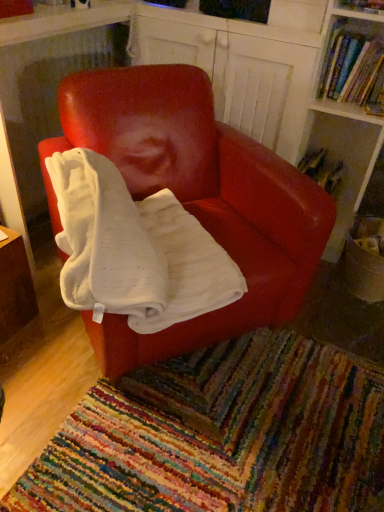
What do you see at coordinates (195, 198) in the screenshot?
I see `matte red chair at center` at bounding box center [195, 198].

Identify the location of matte red chair at center. The height and width of the screenshot is (512, 384). (195, 198).

How much space does hardcover book at upper right, acting as the second book starting from the back, occupy vertically?

hardcover book at upper right, acting as the second book starting from the back, is 11.87 inches tall.

Identify the location of matte red chair at center. This screenshot has height=512, width=384. (195, 198).

Is multicolored woven mat at lower center surrounding matte red chair at center?

Actually, matte red chair at center is outside multicolored woven mat at lower center.

Consider the image. Considering the relative sizes of multicolored woven mat at lower center and matte red chair at center in the image provided, is multicolored woven mat at lower center wider than matte red chair at center?

Yes, multicolored woven mat at lower center is wider than matte red chair at center.

Considering the positions of objects multicolored woven mat at lower center and matte red chair at center in the image provided, who is more to the right, multicolored woven mat at lower center or matte red chair at center?

multicolored woven mat at lower center is more to the right.

Are multicolored woven mat at lower center and matte red chair at center making contact?

No, multicolored woven mat at lower center is not in contact with matte red chair at center.

Which of these two, matte red chair at center or hardcover book at upper right, which is counted as the second book, starting from the bottom, stands shorter?

With less height is hardcover book at upper right, which is counted as the second book, starting from the bottom.

Is matte red chair at center turned away from hardcover book at upper right, the first book from the front?

No, matte red chair at center's orientation is not away from hardcover book at upper right, the first book from the front.

How distant is matte red chair at center from hardcover book at upper right, the first book from the front?

matte red chair at center and hardcover book at upper right, the first book from the front, are 30.21 inches apart.

Does matte red chair at center appear on the left side of hardcover book at upper right, which is counted as the second book, starting from the bottom?

Correct, you'll find matte red chair at center to the left of hardcover book at upper right, which is counted as the second book, starting from the bottom.

Which is correct: hardcover book at upper right, which is the 2th book from top to bottom, is inside multicolored woven mat at lower center, or outside of it?

The correct answer is: outside.

Is hardcover book at upper right, the 1th book in the back-to-front sequence, placed right next to multicolored woven mat at lower center?

No, hardcover book at upper right, the 1th book in the back-to-front sequence, is not beside multicolored woven mat at lower center.

From the image's perspective, is hardcover book at upper right, which is the 2th book from top to bottom, located beneath multicolored woven mat at lower center?

No.

This screenshot has height=512, width=384. I want to click on the 1st book above when counting from the multicolored woven mat at lower center (from the image's perspective), so click(x=321, y=170).

Which object is closer to the camera, multicolored woven mat at lower center or hardcover book at upper right, acting as the second book starting from the back?

Positioned in front is multicolored woven mat at lower center.

Where is `the 1st book behind the multicolored woven mat at lower center, starting your count from the anchor`? The width and height of the screenshot is (384, 512). the 1st book behind the multicolored woven mat at lower center, starting your count from the anchor is located at coordinates (352, 67).

Considering the relative sizes of multicolored woven mat at lower center and hardcover book at upper right, acting as the 1th book starting from the top, in the image provided, is multicolored woven mat at lower center smaller than hardcover book at upper right, acting as the 1th book starting from the top,?

Incorrect, multicolored woven mat at lower center is not smaller in size than hardcover book at upper right, acting as the 1th book starting from the top.

From a real-world perspective, is multicolored woven mat at lower center positioned above or below hardcover book at upper right, acting as the 1th book starting from the top?

From a real-world perspective, multicolored woven mat at lower center is physically below hardcover book at upper right, acting as the 1th book starting from the top.

Is hardcover book at upper right, which is counted as the second book, starting from the bottom, located outside matte red chair at center?

Indeed, hardcover book at upper right, which is counted as the second book, starting from the bottom, is completely outside matte red chair at center.

From the picture: Can you confirm if hardcover book at upper right, which is counted as the second book, starting from the bottom, is wider than matte red chair at center?

In fact, hardcover book at upper right, which is counted as the second book, starting from the bottom, might be narrower than matte red chair at center.

What's the angular difference between hardcover book at upper right, the first book from the front, and matte red chair at center's facing directions?

The facing directions of hardcover book at upper right, the first book from the front, and matte red chair at center are 50 degrees apart.

Which of these two, hardcover book at upper right, acting as the second book starting from the back, or matte red chair at center, stands shorter?

Standing shorter between the two is hardcover book at upper right, acting as the second book starting from the back.

Who is taller, hardcover book at upper right, acting as the second book starting from the back, or hardcover book at upper right, which is the 2th book from top to bottom?

hardcover book at upper right, acting as the second book starting from the back, is taller.

In the scene shown: Which is more to the left, hardcover book at upper right, acting as the 1th book starting from the top, or hardcover book at upper right, which is counted as the 2th book, starting from the front?

Positioned to the left is hardcover book at upper right, which is counted as the 2th book, starting from the front.

Is hardcover book at upper right, the first book from the front, positioned far away from hardcover book at upper right, which is counted as the 2th book, starting from the front?

hardcover book at upper right, the first book from the front, is near hardcover book at upper right, which is counted as the 2th book, starting from the front, not far away.

Which is behind, hardcover book at upper right, which is counted as the second book, starting from the bottom, or hardcover book at upper right, the 1th book in the back-to-front sequence?

hardcover book at upper right, the 1th book in the back-to-front sequence, is further from the camera.

Considering the relative positions of multicolored woven mat at lower center and hardcover book at upper right, which is counted as the 2th book, starting from the front, in the image provided, is multicolored woven mat at lower center to the right of hardcover book at upper right, which is counted as the 2th book, starting from the front, from the viewer's perspective?

No.

From the image's perspective, is multicolored woven mat at lower center positioned above or below hardcover book at upper right, which is counted as the 2th book, starting from the front?

Based on their image positions, multicolored woven mat at lower center is located beneath hardcover book at upper right, which is counted as the 2th book, starting from the front.

Is multicolored woven mat at lower center bigger or smaller than hardcover book at upper right, which is the 2th book from top to bottom?

Clearly, multicolored woven mat at lower center is larger in size than hardcover book at upper right, which is the 2th book from top to bottom.

Is multicolored woven mat at lower center in front of hardcover book at upper right, which is counted as the first book, starting from the bottom?

Yes, multicolored woven mat at lower center is closer to the camera.

Identify the location of chair in front of the multicolored woven mat at lower center. (195, 198).

At what (x,y) coordinates should I click in order to perform the action: click on chair below the hardcover book at upper right, acting as the second book starting from the back (from a real-world perspective). Please return your answer as a coordinate pair (x, y). The image size is (384, 512). Looking at the image, I should click on (195, 198).

From the image, which object appears to be farther from multicolored woven mat at lower center, hardcover book at upper right, acting as the second book starting from the back, or hardcover book at upper right, the 1th book in the back-to-front sequence?

hardcover book at upper right, acting as the second book starting from the back, is positioned further to the anchor multicolored woven mat at lower center.

From the image, which object appears to be nearer to hardcover book at upper right, acting as the 1th book starting from the top, matte red chair at center or hardcover book at upper right, the 1th book in the back-to-front sequence?

Among the two, hardcover book at upper right, the 1th book in the back-to-front sequence, is located nearer to hardcover book at upper right, acting as the 1th book starting from the top.

Which object lies further to the anchor point matte red chair at center, hardcover book at upper right, which is counted as the 2th book, starting from the front, or multicolored woven mat at lower center?

hardcover book at upper right, which is counted as the 2th book, starting from the front, is positioned further to the anchor matte red chair at center.

Which object lies nearer to the anchor point matte red chair at center, multicolored woven mat at lower center or hardcover book at upper right, which is the 2th book from top to bottom?

The object closer to matte red chair at center is multicolored woven mat at lower center.

From the image, which object appears to be nearer to hardcover book at upper right, which is the 2th book from top to bottom, multicolored woven mat at lower center or hardcover book at upper right, which is counted as the second book, starting from the bottom?

hardcover book at upper right, which is counted as the second book, starting from the bottom, is closer to hardcover book at upper right, which is the 2th book from top to bottom.

From the image, which object appears to be farther from hardcover book at upper right, which is counted as the second book, starting from the bottom, hardcover book at upper right, which is the 2th book from top to bottom, or matte red chair at center?

The object further to hardcover book at upper right, which is counted as the second book, starting from the bottom, is matte red chair at center.

Considering their positions, is matte red chair at center positioned further to multicolored woven mat at lower center than hardcover book at upper right, which is counted as the first book, starting from the bottom?

hardcover book at upper right, which is counted as the first book, starting from the bottom.

When comparing their distances from hardcover book at upper right, acting as the second book starting from the back, does matte red chair at center or multicolored woven mat at lower center seem further?

multicolored woven mat at lower center lies further to hardcover book at upper right, acting as the second book starting from the back, than the other object.

Where is `book between hardcover book at upper right, acting as the second book starting from the back, and multicolored woven mat at lower center, in the vertical direction`? Image resolution: width=384 pixels, height=512 pixels. book between hardcover book at upper right, acting as the second book starting from the back, and multicolored woven mat at lower center, in the vertical direction is located at coordinates (321, 170).

Where is `mat between matte red chair at center and hardcover book at upper right, the 1th book in the back-to-front sequence, in the front-back direction`? mat between matte red chair at center and hardcover book at upper right, the 1th book in the back-to-front sequence, in the front-back direction is located at coordinates (220, 435).

Image resolution: width=384 pixels, height=512 pixels. In order to click on book between matte red chair at center and hardcover book at upper right, which is counted as the first book, starting from the bottom, from front to back in this screenshot , I will do `click(352, 67)`.

Locate an element on the screen. chair between hardcover book at upper right, acting as the second book starting from the back, and multicolored woven mat at lower center in the up-down direction is located at coordinates (195, 198).